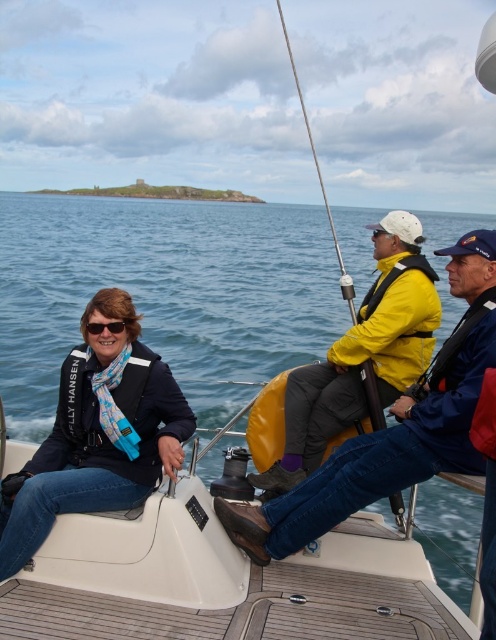
Does point (79, 364) lie in front of point (328, 385)?

Yes, point (79, 364) is closer to viewer.

Which is in front, point (125, 474) or point (404, 326)?

Positioned in front is point (125, 474).

What are the coordinates of `blue fabric jacket at lower left` in the screenshot? It's located at (98, 435).

Does point (366, 358) lie in front of point (370, 419)?

Yes.

The width and height of the screenshot is (496, 640). Describe the element at coordinates (362, 355) in the screenshot. I see `yellow matte jacket at center` at that location.

Locate an element on the screen. Image resolution: width=496 pixels, height=640 pixels. yellow matte jacket at center is located at coordinates pyautogui.click(x=362, y=355).

Is white plastic boat at center positioned in front of metallic fishing pole at upper center?

Yes, it is.

Who is positioned more to the left, white plastic boat at center or metallic fishing pole at upper center?

white plastic boat at center

The width and height of the screenshot is (496, 640). Describe the element at coordinates (164, 291) in the screenshot. I see `white plastic boat at center` at that location.

The height and width of the screenshot is (640, 496). In order to click on white plastic boat at center in this screenshot , I will do `click(164, 291)`.